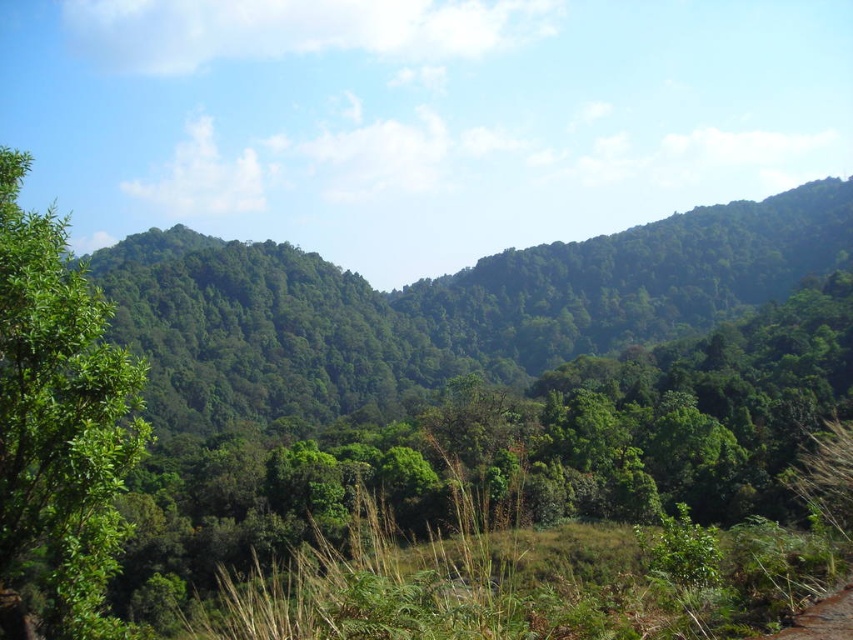
You are hiking through the forest and want to know if the green leafy forest at center is higher than the green leafy tree at left. Can you determine this based on the scene?

The green leafy forest at center is above the green leafy tree at left, so yes, the green leafy forest at center is higher than the green leafy tree at left.

You are a hiker trying to navigate through the green leafy forest at center and the green leafy tree at left. Which one would block your view more if you were standing in front of them?

The green leafy forest at center would block your view more because the green leafy tree at left is behind it, making the forest the closer and denser obstruction.